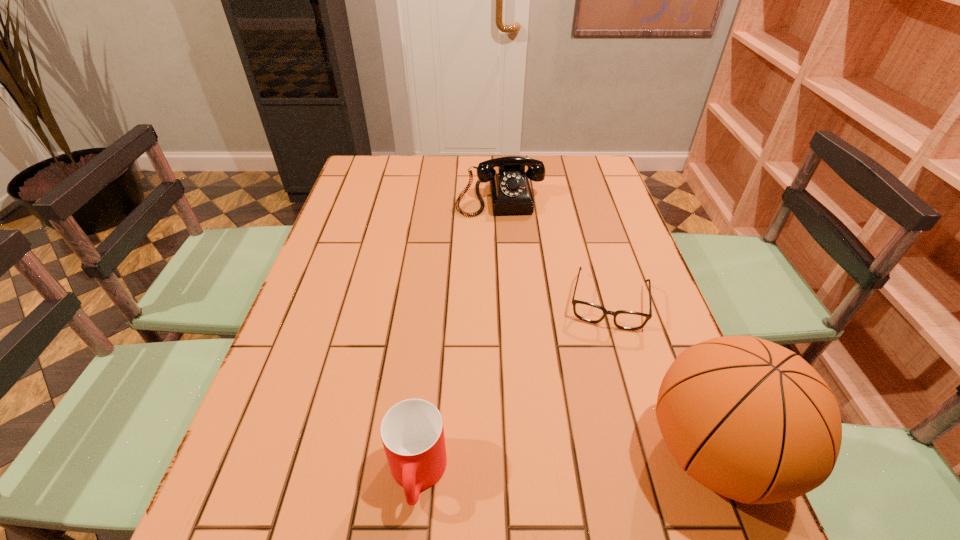
The image size is (960, 540). Find the location of `cup`. cup is located at coordinates (412, 433).

The height and width of the screenshot is (540, 960). Find the location of `basketball`. basketball is located at coordinates (747, 418).

Where is `the farthest object`? The width and height of the screenshot is (960, 540). the farthest object is located at coordinates (510, 192).

Where is `the third nearest object`? The height and width of the screenshot is (540, 960). the third nearest object is located at coordinates (627, 320).

Identify the location of the shortest object. (627, 320).

Find the location of `free space located on the back of the basketball`. free space located on the back of the basketball is located at coordinates (651, 295).

Locate an element on the screen. vacant space located on the dial of the telephone is located at coordinates (512, 275).

This screenshot has height=540, width=960. Find the location of `free space located 0.250m on the dial of the telephone`. free space located 0.250m on the dial of the telephone is located at coordinates click(x=512, y=272).

Identify the location of vacant position located on the dial of the telephone. (509, 255).

Where is `vacant space located 0.200m on the front-facing side of the spectacles`? The image size is (960, 540). vacant space located 0.200m on the front-facing side of the spectacles is located at coordinates (596, 404).